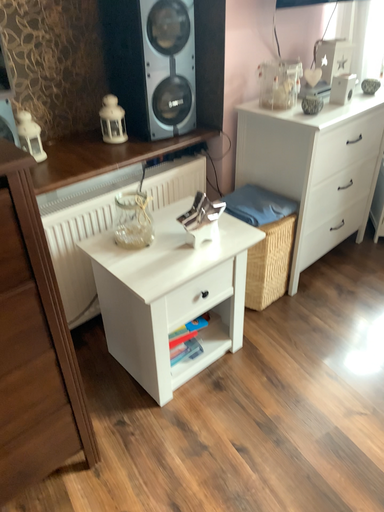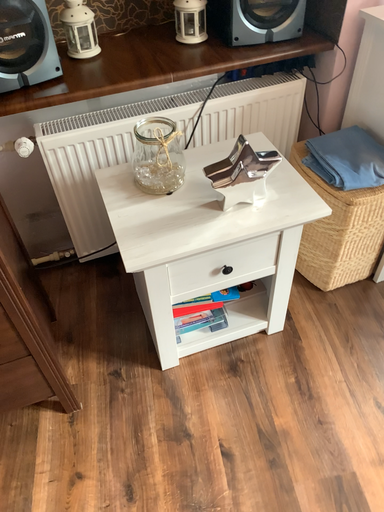
Question: Which way did the camera rotate in the video?

Choices:
 (A) rotated upward
 (B) rotated downward

Answer: (B)